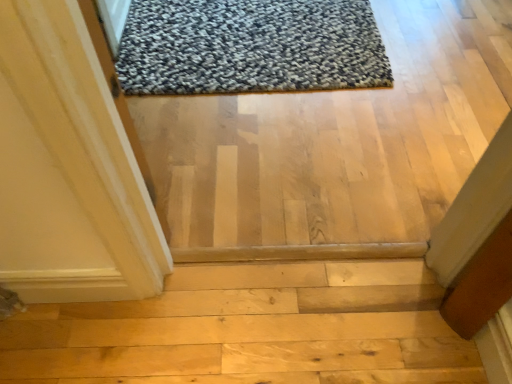
Locate an element on the screen. The height and width of the screenshot is (384, 512). empty space that is to the right of textured gray rug at upper center is located at coordinates (439, 59).